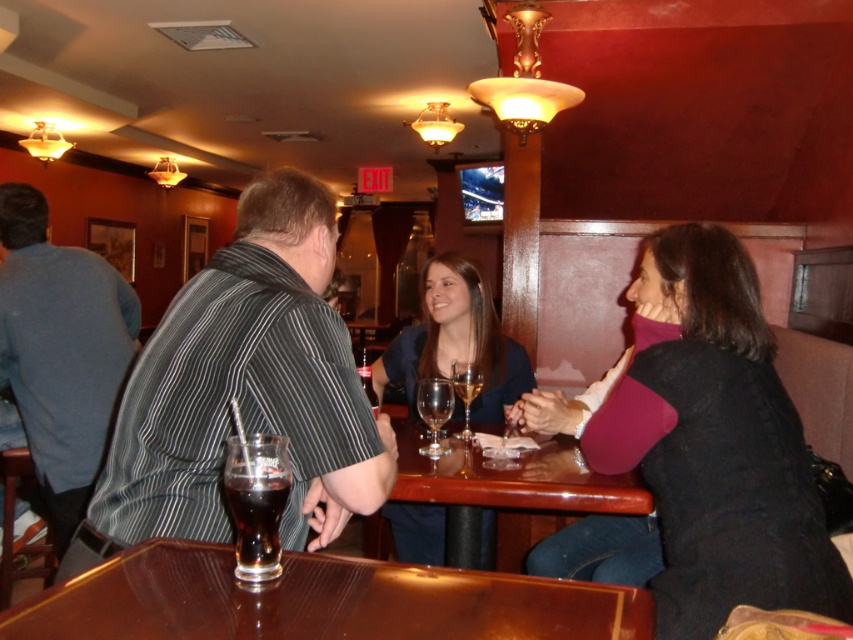
Question: Which object is farther from the camera taking this photo?

Choices:
 (A) translucent glass at table center
 (B) striped fabric shirt at center

Answer: (A)

Question: Is black sweater at center to the right of dark glass at table center from the viewer's perspective?

Choices:
 (A) yes
 (B) no

Answer: (A)

Question: Can you confirm if matte blue shirt at center is positioned above transparent glass wine glass at center?

Choices:
 (A) no
 (B) yes

Answer: (B)

Question: Which object appears closest to the camera in this image?

Choices:
 (A) glossy wood table at center
 (B) transparent glass wine glass at center
 (C) matte blue shirt at center

Answer: (A)

Question: Does black sweater at center appear under transparent glass wine glass at center?

Choices:
 (A) no
 (B) yes

Answer: (A)

Question: Based on their relative distances, which object is farther from the black sweater at center?

Choices:
 (A) translucent glass at table center
 (B) transparent glass wine glass at center

Answer: (A)